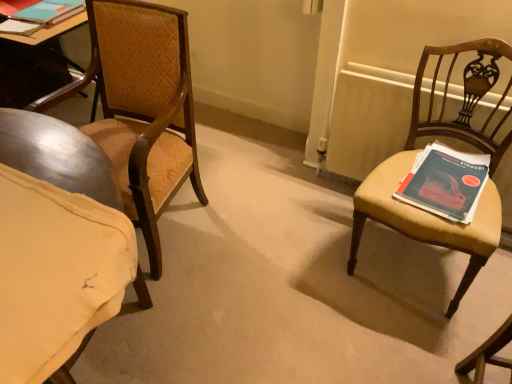
Find the location of a particular element. The image size is (512, 384). vacant space positioned to the left of matte brown chair at right, arranged as the 2th chair when viewed from the left is located at coordinates (306, 262).